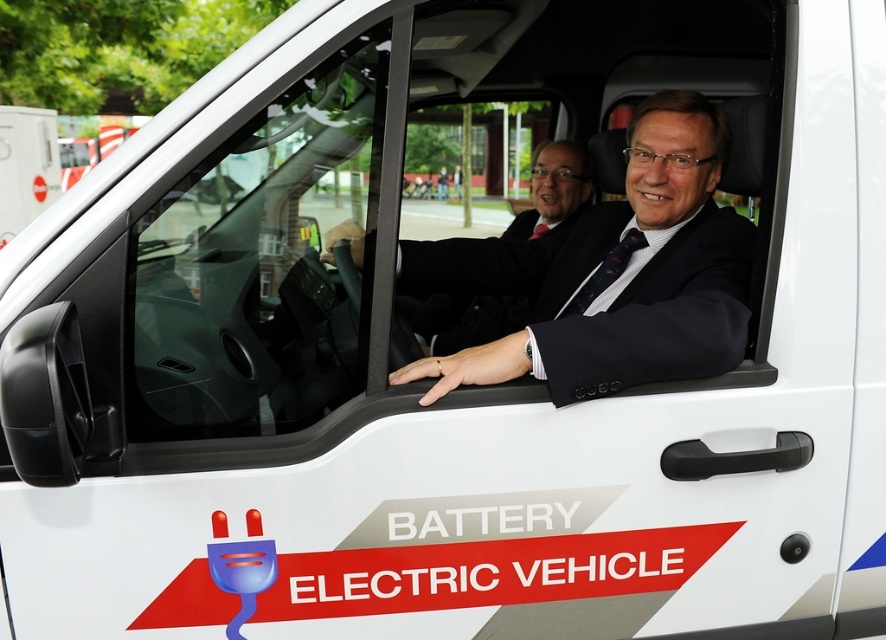
Question: Which of the following is the closest to the observer?

Choices:
 (A) black textured tie at center
 (B) black silk tie at driver's seat

Answer: (A)

Question: Can you confirm if black textured tie at center is positioned above black silk tie at driver's seat?

Choices:
 (A) no
 (B) yes

Answer: (A)

Question: Is black textured tie at center closer to camera compared to black silk tie at driver's seat?

Choices:
 (A) yes
 (B) no

Answer: (A)

Question: Can you confirm if black textured tie at center is positioned below black silk tie at driver's seat?

Choices:
 (A) no
 (B) yes

Answer: (B)

Question: Which of the following is the closest to the observer?

Choices:
 (A) tap(650, 330)
 (B) tap(627, 236)

Answer: (A)

Question: Based on their relative distances, which object is farther from the dark blue suit at center?

Choices:
 (A) black silk tie at driver's seat
 (B) black textured tie at center

Answer: (A)